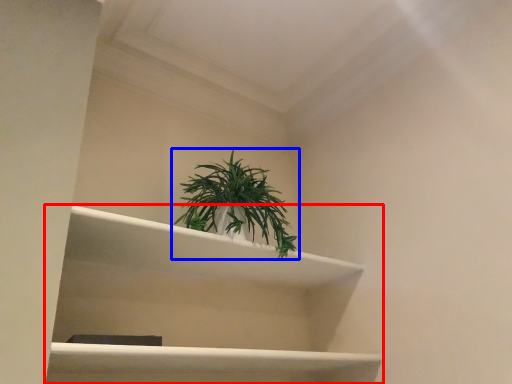
Question: Which of the following is the closest to the observer, shelf (highlighted by a red box) or houseplant (highlighted by a blue box)?

Choices:
 (A) shelf
 (B) houseplant

Answer: (A)